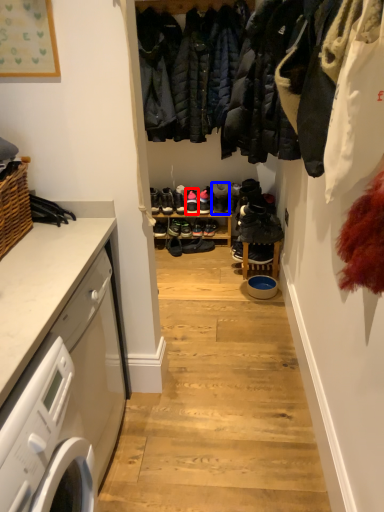
Question: Which object is further to the camera taking this photo, footwear (highlighted by a red box) or shoe (highlighted by a blue box)?

Choices:
 (A) footwear
 (B) shoe

Answer: (A)